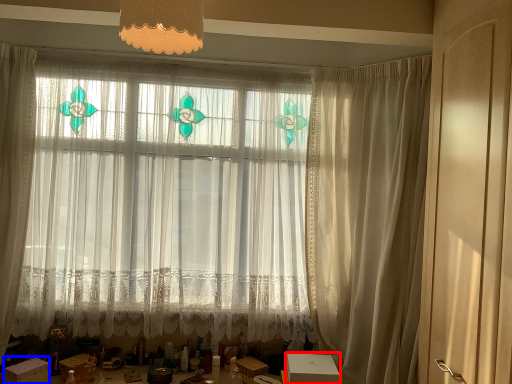
Question: Which object appears closest to the camera in this image, cardboard box (highlighted by a red box) or cardboard box (highlighted by a blue box)?

Choices:
 (A) cardboard box
 (B) cardboard box

Answer: (B)